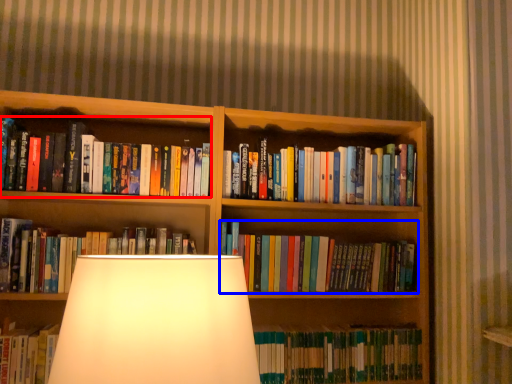
Question: Which object is closer to the camera taking this photo, book (highlighted by a red box) or book (highlighted by a blue box)?

Choices:
 (A) book
 (B) book

Answer: (A)